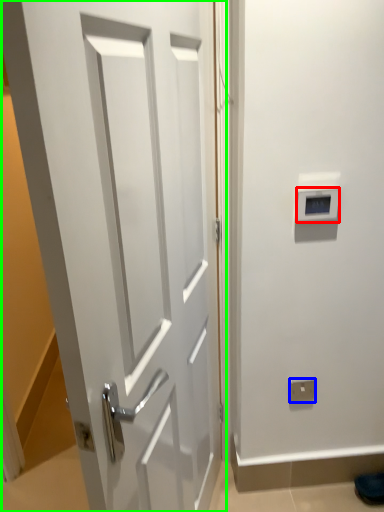
Question: Which object is the closest to the thermostat (highlighted by a red box)? Choose among these: electric outlet (highlighted by a blue box) or door (highlighted by a green box).

Choices:
 (A) electric outlet
 (B) door

Answer: (B)